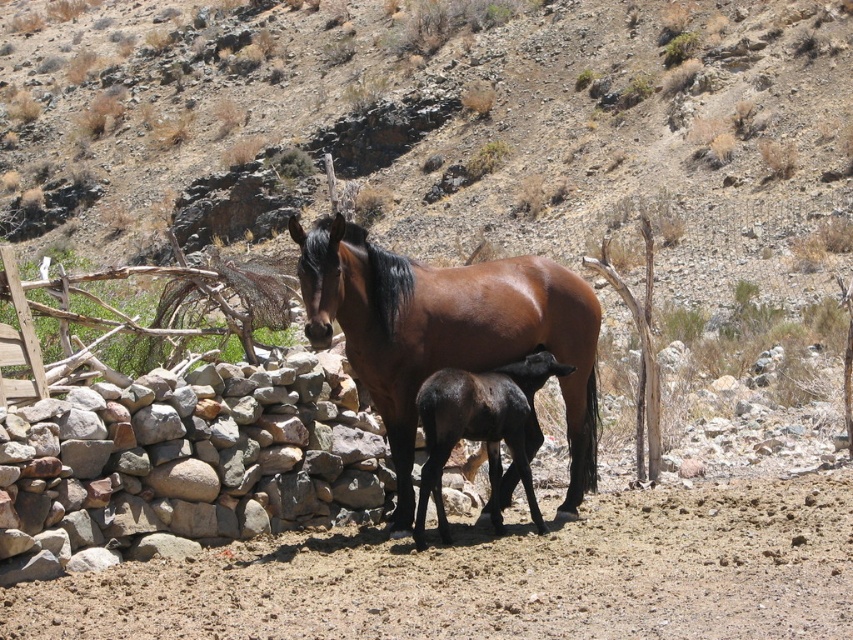
You are a farmer checking on your animals in the dry landscape. You see the gray rough stone at lower left and the brown glossy horse at center. Which object is positioned to the right of the other?

The gray rough stone at lower left is positioned to the right of the brown glossy horse at center.

What is located at the coordinates point (x=181, y=465) in the image?

The coordinates point (x=181, y=465) indicate a gray rough stone at lower left.

You are a photographer standing at the origin point of the image coordinate system. You want to capture a photo of the brown glossy horse at center. What are the coordinates where you should aim your camera?

The coordinates to aim the camera are at point (447, 333), where the brown glossy horse at center is located.